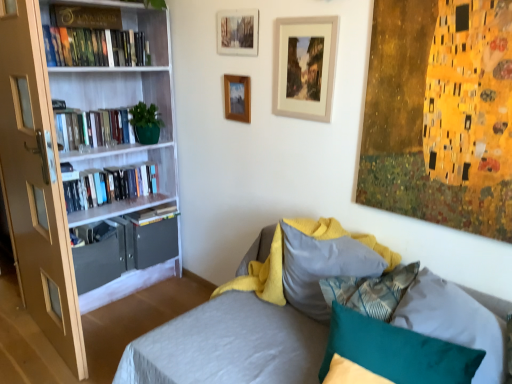
I want to click on wooden picture frame at upper center, the 2th picture frame in the left-to-right sequence, so click(238, 32).

Describe the element at coordinates (321, 267) in the screenshot. This screenshot has width=512, height=384. I see `textured gray pillow at center, which is the 1th pillow from back to front` at that location.

Locate an element on the screen. matte gray drawer at lower left is located at coordinates (98, 255).

What is the approximate width of white glossy bookcase at left?

15.35 inches.

I want to click on hardcover books at left, which is the third book from bottom to top, so click(93, 128).

From the image's perspective, relative to wooden picture frame at upper center, the third picture frame from the left, is hardcover book at left, which appears as the 2th book when viewed from the top, above or below?

Based on their image positions, hardcover book at left, which appears as the 2th book when viewed from the top, is located above wooden picture frame at upper center, the third picture frame from the left.

Which is behind, hardcover book at left, which appears as the 2th book when viewed from the top, or wooden picture frame at upper center, the first picture frame in the right-to-left sequence?

hardcover book at left, which appears as the 2th book when viewed from the top, is further from the camera.

Is there a large distance between hardcover book at left, which is counted as the fourth book, starting from the bottom, and wooden picture frame at upper center, the first picture frame in the right-to-left sequence?

Yes, hardcover book at left, which is counted as the fourth book, starting from the bottom, and wooden picture frame at upper center, the first picture frame in the right-to-left sequence, are located far from each other.

Does wooden picture frame at upper center, which is the 3th picture frame from right to left, have a greater width compared to hardcover book at left, arranged as the 5th book when viewed from the top?

No.

Based on the photo, based on their sizes in the image, would you say wooden picture frame at upper center, placed as the first picture frame when sorted from left to right, is bigger or smaller than hardcover book at left, arranged as the 5th book when viewed from the top?

wooden picture frame at upper center, placed as the first picture frame when sorted from left to right, is smaller than hardcover book at left, arranged as the 5th book when viewed from the top.

Does wooden picture frame at upper center, which is the 3th picture frame from right to left, appear on the left side of hardcover book at left, the 1th book ordered from the bottom?

Incorrect, wooden picture frame at upper center, which is the 3th picture frame from right to left, is not on the left side of hardcover book at left, the 1th book ordered from the bottom.

In the image, is wooden picture frame at upper center, placed as the first picture frame when sorted from left to right, positioned in front of or behind hardcover book at left, the 1th book ordered from the bottom?

wooden picture frame at upper center, placed as the first picture frame when sorted from left to right, is positioned closer to the viewer than hardcover book at left, the 1th book ordered from the bottom.

Considering the sizes of wooden picture frame at upper center, placed as the first picture frame when sorted from left to right, and gold metallic sign at upper left, which is the 1th book from top to bottom, in the image, is wooden picture frame at upper center, placed as the first picture frame when sorted from left to right, wider or thinner than gold metallic sign at upper left, which is the 1th book from top to bottom,?

wooden picture frame at upper center, placed as the first picture frame when sorted from left to right, is thinner than gold metallic sign at upper left, which is the 1th book from top to bottom.

From the gold metallic sign at upper left, which is the 1th book from top to bottom, count 1st picture frame to the right and point to it. Please provide its 2D coordinates.

[(237, 98)]

Do you think wooden picture frame at upper center, placed as the first picture frame when sorted from left to right, is within gold metallic sign at upper left, which is the 5th book from bottom to top, or outside of it?

wooden picture frame at upper center, placed as the first picture frame when sorted from left to right, is not inside gold metallic sign at upper left, which is the 5th book from bottom to top, it's outside.

Would you consider wooden picture frame at upper center, placed as the first picture frame when sorted from left to right, to be distant from gold metallic sign at upper left, which is the 1th book from top to bottom?

That's not correct — wooden picture frame at upper center, placed as the first picture frame when sorted from left to right, is a little close to gold metallic sign at upper left, which is the 1th book from top to bottom.

Is the position of textured gray couch at center less distant than that of hardcover book at left, which appears as the 2th book when viewed from the top?

Yes.

Where is `the 2nd book to the left when counting from the textured gray couch at center`? The width and height of the screenshot is (512, 384). the 2nd book to the left when counting from the textured gray couch at center is located at coordinates (95, 47).

Which is more to the left, textured gray couch at center or hardcover book at left, which appears as the 2th book when viewed from the top?

From the viewer's perspective, hardcover book at left, which appears as the 2th book when viewed from the top, appears more on the left side.

Does textured gray couch at center have a greater height compared to hardcover book at left, which is counted as the fourth book, starting from the bottom?

Yes.

Considering the sizes of textured gray pillow at center, which is the 1th pillow from back to front, and textured gray couch at center in the image, is textured gray pillow at center, which is the 1th pillow from back to front, bigger or smaller than textured gray couch at center?

Considering their sizes, textured gray pillow at center, which is the 1th pillow from back to front, takes up less space than textured gray couch at center.

Does textured gray pillow at center, which is the 1th pillow from back to front, turn towards textured gray couch at center?

Yes, textured gray pillow at center, which is the 1th pillow from back to front, faces towards textured gray couch at center.

What's the angular difference between textured gray pillow at center, which appears as the second pillow when viewed from the front, and textured gray couch at center's facing directions?

3.42 degrees separate the facing orientations of textured gray pillow at center, which appears as the second pillow when viewed from the front, and textured gray couch at center.

Locate an element on the screen. This screenshot has height=384, width=512. studio couch that is on the left side of textured gray pillow at center, which is the 1th pillow from back to front is located at coordinates tap(226, 347).

At what (x,y) coordinates should I click in order to perform the action: click on the 1st picture frame counting from the right of the white glossy bookcase at left. Please return your answer as a coordinate pair (x, y). Looking at the image, I should click on (237, 98).

Can you confirm if wooden picture frame at upper center, placed as the first picture frame when sorted from left to right, is thinner than white glossy bookcase at left?

Indeed, wooden picture frame at upper center, placed as the first picture frame when sorted from left to right, has a lesser width compared to white glossy bookcase at left.

Is wooden picture frame at upper center, which is the 3th picture frame from right to left, turned away from white glossy bookcase at left?

No.

Is gold metallic sign at upper left, which is the 1th book from top to bottom, inside the boundaries of wooden picture frame at upper center, the second picture frame in the right-to-left sequence, or outside?

gold metallic sign at upper left, which is the 1th book from top to bottom, is not enclosed by wooden picture frame at upper center, the second picture frame in the right-to-left sequence.

Is point (63, 13) behind point (230, 29)?

Yes, point (63, 13) is behind point (230, 29).

Identify the location of the 2nd picture frame counting from the right of the gold metallic sign at upper left, which is the 5th book from bottom to top. (238, 32).

Is gold metallic sign at upper left, which is the 1th book from top to bottom, far away from wooden picture frame at upper center, the second picture frame in the right-to-left sequence?

They are positioned close to each other.

Where is `the 3rd picture frame to the right when counting from the hardcover book at left, which appears as the 2th book when viewed from the top`? the 3rd picture frame to the right when counting from the hardcover book at left, which appears as the 2th book when viewed from the top is located at coordinates (305, 67).

Find the location of `the 1st picture frame above the hardcover book at left, the 1th book ordered from the bottom (from the image's perspective)`. the 1st picture frame above the hardcover book at left, the 1th book ordered from the bottom (from the image's perspective) is located at coordinates (237, 98).

From the image, which object appears to be farther from textured gray couch at center, hardcover books at left, which is the third book from bottom to top, or textured gray pillow at center, which is the 1th pillow from back to front?

hardcover books at left, which is the third book from bottom to top, is further to textured gray couch at center.

Looking at the image, which one is located closer to hardcover book at left, which appears as the 2th book when viewed from the top, textured gray couch at center or matte gray drawer at lower left?

Among the two, matte gray drawer at lower left is located nearer to hardcover book at left, which appears as the 2th book when viewed from the top.

Which object lies nearer to the anchor point matte beige door at left, white glossy bookcase at left or textured gray couch at center?

Based on the image, white glossy bookcase at left appears to be nearer to matte beige door at left.

From the image, which object appears to be nearer to hardcover book at left, which is counted as the fourth book, starting from the bottom, white glossy bookcase at left or textured gray pillow at center, which is the 1th pillow from back to front?

Among the two, white glossy bookcase at left is located nearer to hardcover book at left, which is counted as the fourth book, starting from the bottom.

From the image, which object appears to be nearer to white glossy bookcase at left, wooden picture frame at upper center, the 2th picture frame in the left-to-right sequence, or textured gray pillow at center, which appears as the second pillow when viewed from the front?

Based on the image, wooden picture frame at upper center, the 2th picture frame in the left-to-right sequence, appears to be nearer to white glossy bookcase at left.

Considering their positions, is wooden picture frame at upper center, which is the 3th picture frame from right to left, positioned further to matte gray drawer at lower left than hardcover books at left, which is the fourth book in top-to-bottom order?

The object further to matte gray drawer at lower left is wooden picture frame at upper center, which is the 3th picture frame from right to left.

Considering their positions, is teal fabric pillow at lower right, arranged as the 1th pillow when viewed from the front, positioned closer to matte gray drawer at lower left than gold metallic sign at upper left, which is the 5th book from bottom to top?

The object closer to matte gray drawer at lower left is gold metallic sign at upper left, which is the 5th book from bottom to top.

Estimate the real-world distances between objects in this image. Which object is further from wooden picture frame at upper center, the 2th picture frame in the left-to-right sequence, hardcover books at left, which is counted as the 2th book, starting from the bottom, or matte beige door at left?

matte beige door at left.

This screenshot has width=512, height=384. I want to click on pillow situated between white glossy bookcase at left and teal fabric pillow at lower right, arranged as the 1th pillow when viewed from the front, from left to right, so click(x=321, y=267).

You are a GUI agent. You are given a task and a screenshot of the screen. Output one action in this format:
    pyautogui.click(x=<x>, y=<y>)
    Task: Click on the picture frame between wooden picture frame at upper center, the first picture frame in the right-to-left sequence, and teal fabric pillow at lower right, which appears as the second pillow when viewed from the back, vertically
    This screenshot has width=512, height=384.
    Given the screenshot: What is the action you would take?
    pyautogui.click(x=237, y=98)

Identify the location of drawer positioned between matte beige door at left and hardcover book at left, the 1th book ordered from the bottom, from near to far. The width and height of the screenshot is (512, 384). (98, 255).

Where is `bookcase between gold metallic sign at upper left, which is the 5th book from bottom to top, and teal fabric pillow at lower right, which appears as the second pillow when viewed from the back, in the horizontal direction`? This screenshot has height=384, width=512. bookcase between gold metallic sign at upper left, which is the 5th book from bottom to top, and teal fabric pillow at lower right, which appears as the second pillow when viewed from the back, in the horizontal direction is located at coordinates (82, 160).